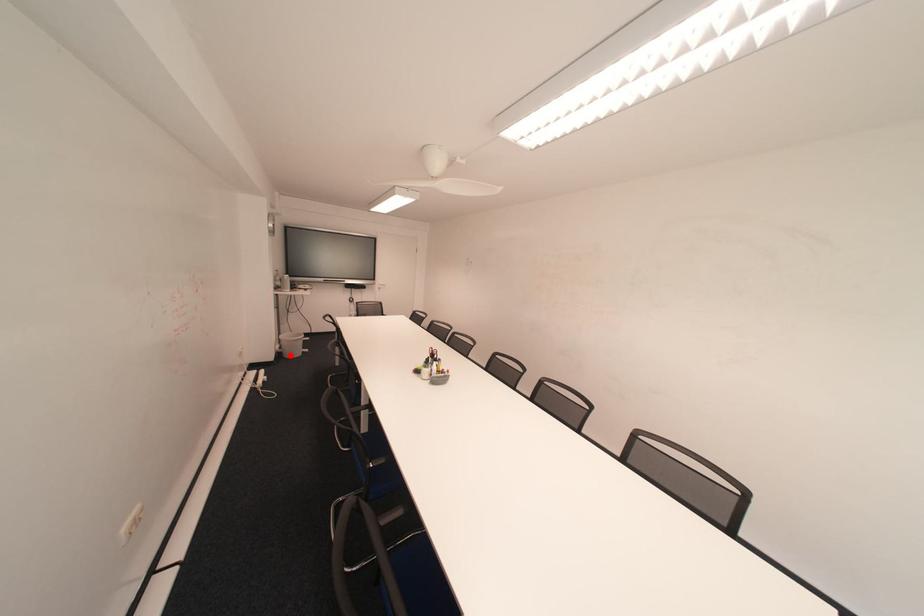
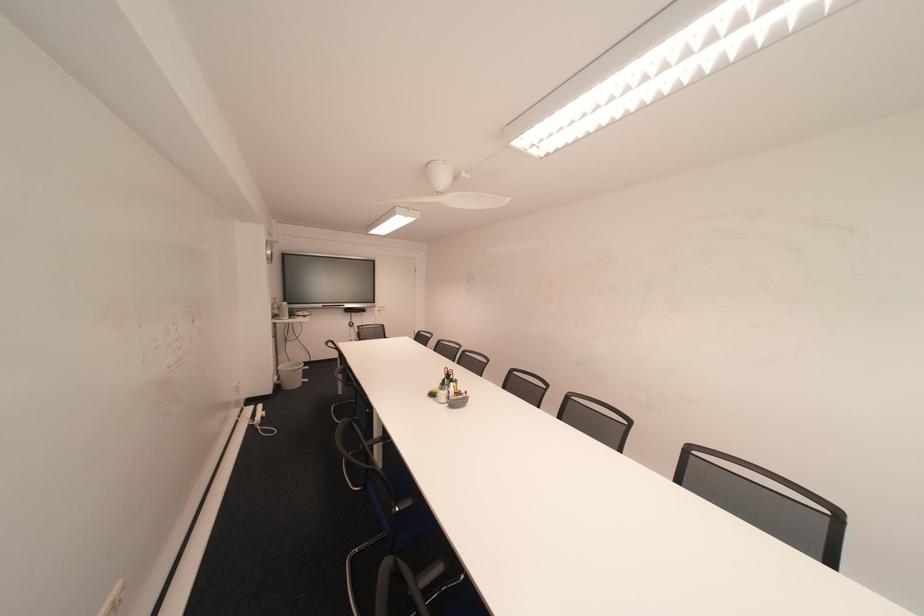
Where in the second image is the point corresponding to the highlighted location from the first image?

(288, 387)